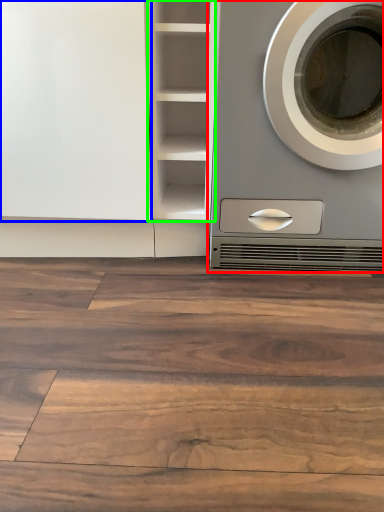
Question: Which is farther away from washing machine (highlighted by a red box)? glass door (highlighted by a blue box) or cabinet (highlighted by a green box)?

Choices:
 (A) glass door
 (B) cabinet

Answer: (A)